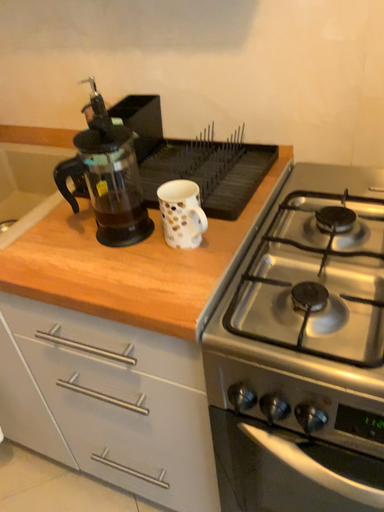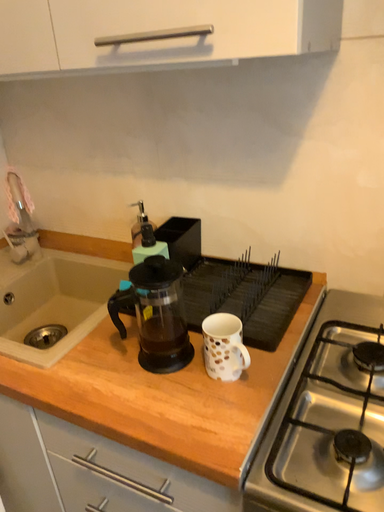
Question: How did the camera likely rotate when shooting the video?

Choices:
 (A) rotated upward
 (B) rotated downward

Answer: (A)